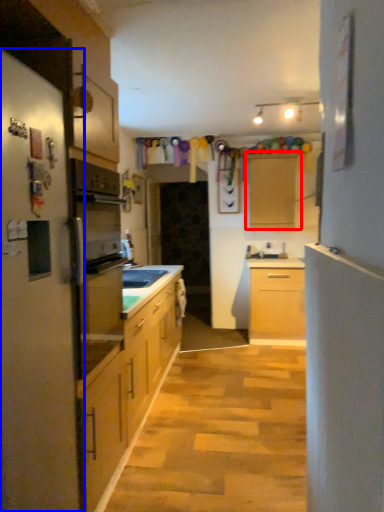
Question: Which point is closer to the camera, cabinetry (highlighted by a red box) or fridge (highlighted by a blue box)?

Choices:
 (A) cabinetry
 (B) fridge

Answer: (B)